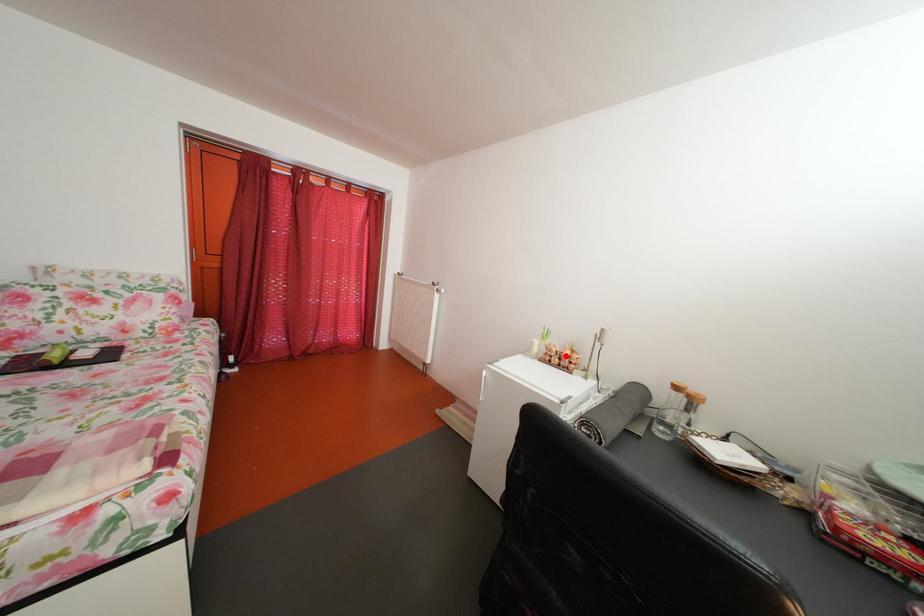
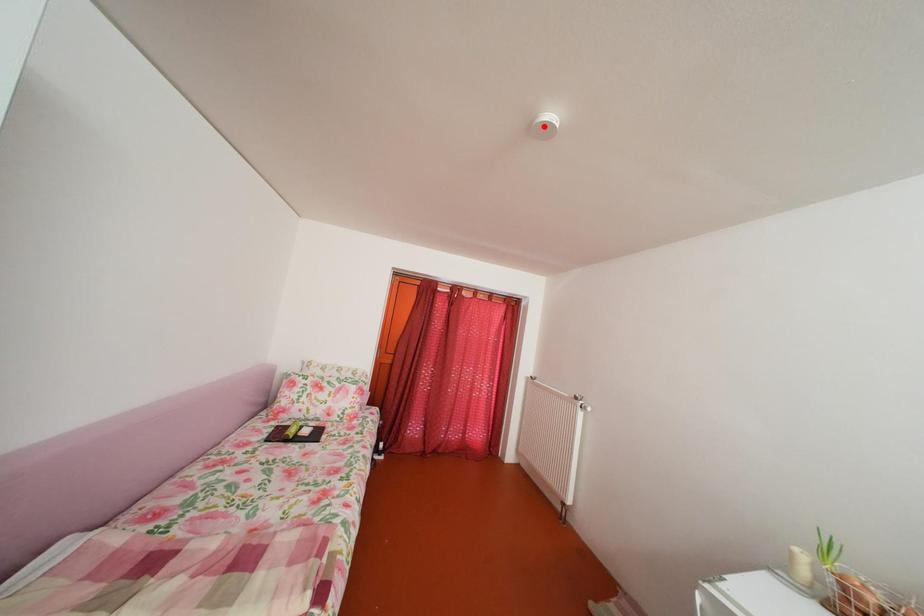
I am providing you with two images of the same scene from different viewpoints. A red point is marked on the first image and another point is marked on the second image. Are the points marked in image1 and image2 representing the same 3D position?

No